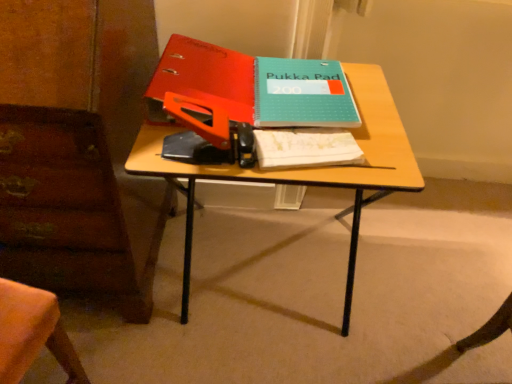
I want to click on spots to the right of teal matte notebook at center, which is the second paperback book from left to right, so pos(374,107).